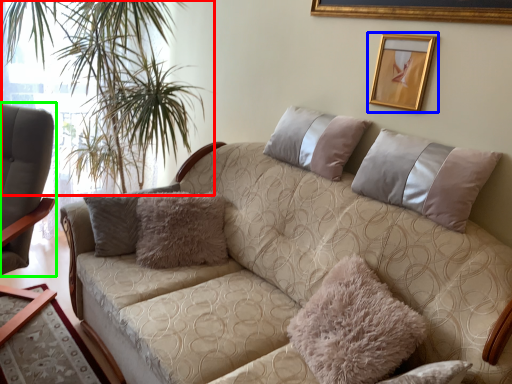
Question: Based on their relative distances, which object is nearer to plant (highlighted by a red box)? Choose from picture frame (highlighted by a blue box) and chair (highlighted by a green box).

Choices:
 (A) picture frame
 (B) chair

Answer: (B)